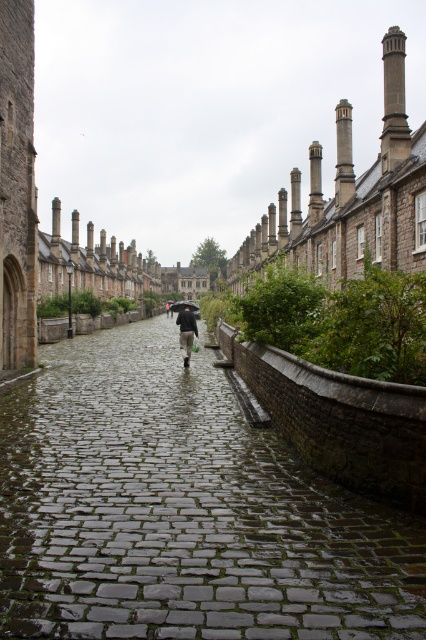
Question: Is wet cobblestone pavement at center below black matte umbrella at center?

Choices:
 (A) yes
 (B) no

Answer: (A)

Question: Which is farther from the wet cobblestone pavement at center?

Choices:
 (A) dark gray fabric jacket at center
 (B) black matte umbrella at center

Answer: (B)

Question: Which object is farther from the camera taking this photo?

Choices:
 (A) black matte umbrella at center
 (B) dark gray fabric jacket at center
 (C) wet cobblestone pavement at center

Answer: (A)

Question: Does wet cobblestone pavement at center have a larger size compared to black matte umbrella at center?

Choices:
 (A) no
 (B) yes

Answer: (A)

Question: Can you confirm if wet cobblestone pavement at center is smaller than dark gray fabric jacket at center?

Choices:
 (A) no
 (B) yes

Answer: (A)

Question: Which of the following is the closest to the observer?

Choices:
 (A) wet cobblestone pavement at center
 (B) dark gray fabric jacket at center

Answer: (A)